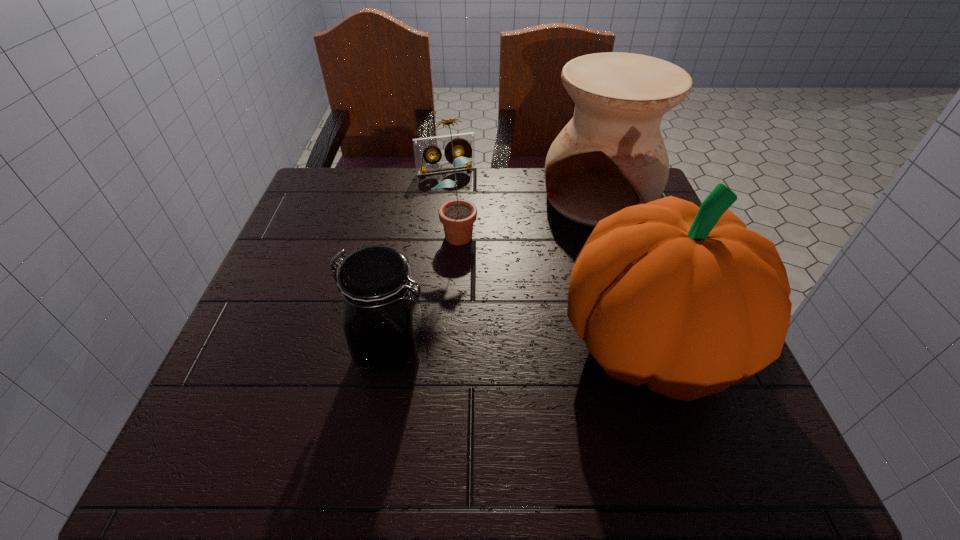
The width and height of the screenshot is (960, 540). I want to click on vacant space on the desktop that is between the jar and the pumpkin and is positioned on the flower of the sunflower, so tap(496, 348).

Where is `free spot on the desktop that is between the second shortest object and the pumpkin and is positioned at the open side of the pottery`? This screenshot has height=540, width=960. free spot on the desktop that is between the second shortest object and the pumpkin and is positioned at the open side of the pottery is located at coordinates (506, 347).

In order to click on vacant space on the desktop that is between the jar and the pumpkin and is positioned at the front of the shortest object with visible reels in this screenshot , I will do `click(509, 347)`.